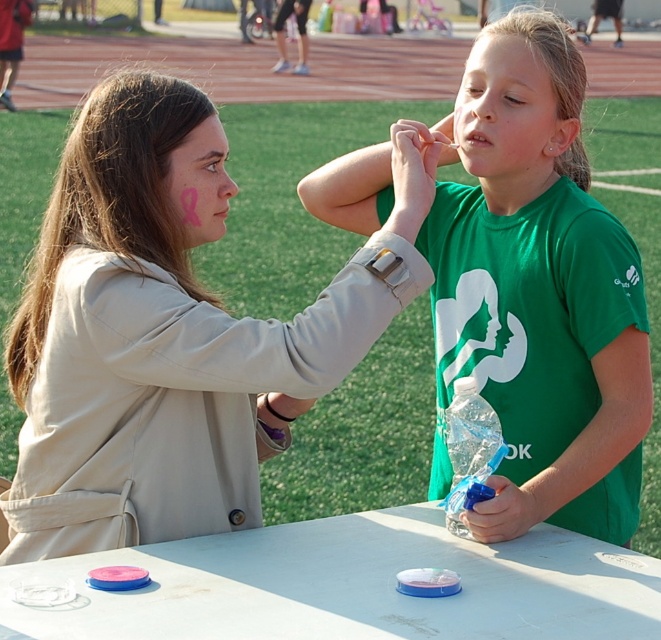
You are organizing a Girl Scout event and need to distribute craft supplies. You have a pink matte ribbon at left and a pink matte face paint at upper center. Which item is bigger in size?

The pink matte ribbon at left is larger in size than the pink matte face paint at upper center.

You are taking a photo of the two people in the foreground. Which point, point (40, 417) or point (475, 161), will appear larger in your photo?

Point (40, 417) is closer to the camera than point (475, 161), so it will appear larger in the photo.

You are organizing a craft fair and need to display two items from the image. The pink matte ribbon at left and the pink matte face paint at upper center. If you want to place them side by side on a shelf, which one should you put on the left to ensure they both fit without overlapping?

The pink matte ribbon at left is wider than the pink matte face paint at upper center, so placing the wider pink matte ribbon at left on the left side would allow both items to fit side by side without overlapping.